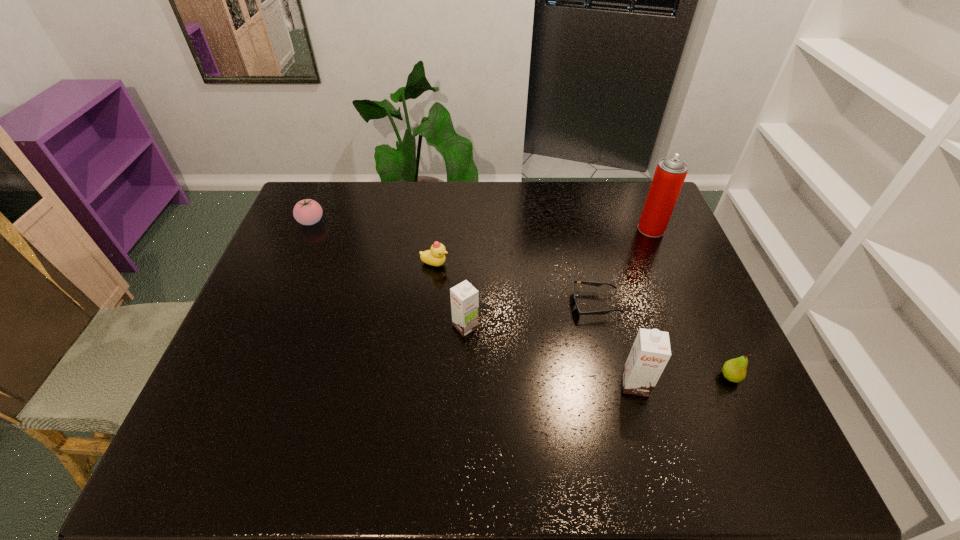
Locate an element on the screen. Image resolution: width=960 pixels, height=540 pixels. free spot between the tomato and the sixth object from right to left is located at coordinates (372, 243).

At what (x,y) coordinates should I click in order to perform the action: click on object that ranks as the fifth closest to the shortest object. Please return your answer as a coordinate pair (x, y). The image size is (960, 540). Looking at the image, I should click on (435, 256).

Select which object appears as the second closest to the aerosol can. Please provide its 2D coordinates. Your answer should be formatted as a tuple, i.e. [(x, y)], where the tuple contains the x and y coordinates of a point satisfying the conditions above.

[(734, 370)]

Locate an element on the screen. This screenshot has height=540, width=960. vacant space that satisfies the following two spatial constraints: 1. on the front-facing side of the pear; 2. on the left side of the fifth nearest object is located at coordinates (423, 377).

What are the coordinates of `free space that satisfies the following two spatial constraints: 1. on the front-facing side of the taller chocolate milk; 2. on the left side of the third farthest object` in the screenshot? It's located at (422, 384).

I want to click on free space that satisfies the following two spatial constraints: 1. on the front side of the pear; 2. on the right side of the tallest object, so click(713, 377).

The height and width of the screenshot is (540, 960). Identify the location of free location that satisfies the following two spatial constraints: 1. on the back side of the right chocolate milk; 2. on the front-facing side of the sunglasses. (613, 305).

At what (x,y) coordinates should I click in order to perform the action: click on vacant region that satisfies the following two spatial constraints: 1. on the front-facing side of the shortest object; 2. on the right side of the taller chocolate milk. Please return your answer as a coordinate pair (x, y). The width and height of the screenshot is (960, 540). Looking at the image, I should click on (614, 384).